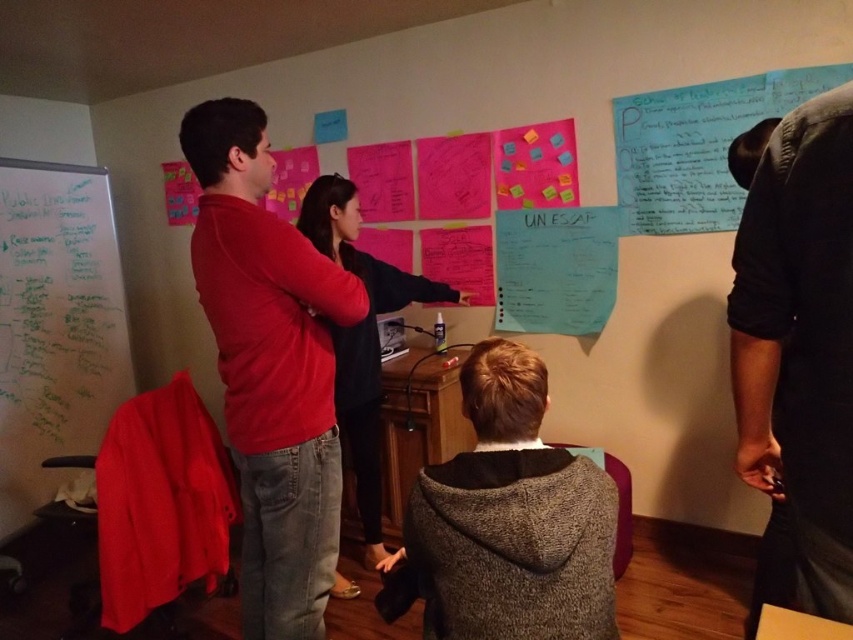
Question: Which object appears farthest from the camera in this image?

Choices:
 (A) matte red shirt at center
 (B) dark gray shirt at upper right
 (C) whiteboard at left

Answer: (C)

Question: Among these objects, which one is farthest from the camera?

Choices:
 (A) dark gray hoodie at center
 (B) whiteboard at left

Answer: (B)

Question: Can you confirm if dark gray hoodie at center is positioned to the left of whiteboard at left?

Choices:
 (A) yes
 (B) no

Answer: (B)

Question: Does matte red shirt at center appear on the right side of dark gray shirt at upper right?

Choices:
 (A) yes
 (B) no

Answer: (B)

Question: In this image, where is dark gray hoodie at center located relative to black sweater at center?

Choices:
 (A) left
 (B) right

Answer: (B)

Question: Which of the following is the closest to the observer?

Choices:
 (A) black sweater at center
 (B) dark gray hoodie at center
 (C) white paper at center

Answer: (B)